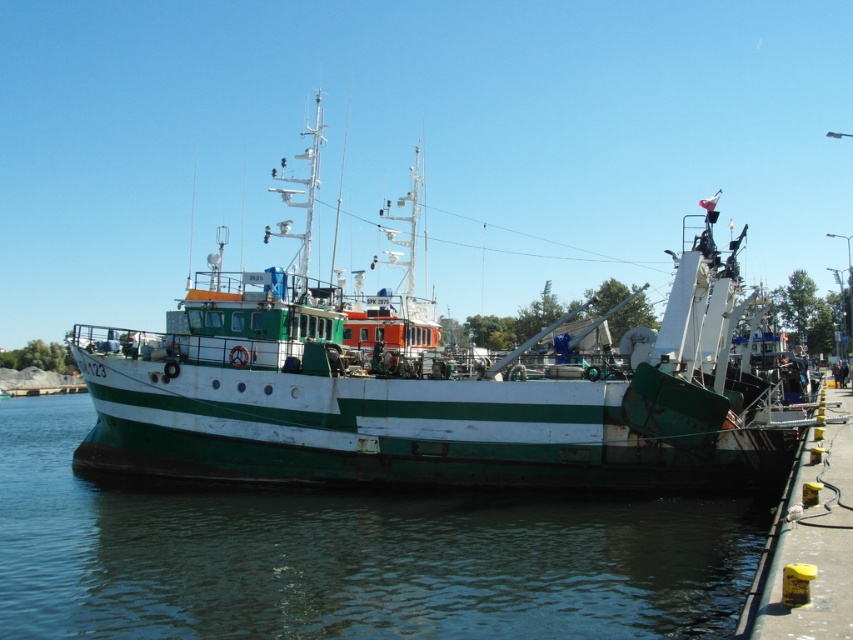
Based on the photo, you are standing at the edge of the pier and want to locate the green matte water at lower center. According to the coordinates provided, what are the exact coordinates where you can find it?

The green matte water at lower center can be found at point (349, 556).

You are an observer standing on the pier and looking at the green matte water at lower center and the green matte boat at center. Which object appears taller from your viewpoint?

The green matte boat at center appears taller than the green matte water at lower center since the water has a lesser height compared to the boat.

You are standing on the pier and see the green matte water at lower center and the green matte boat at center. Which object is located to the right of the other?

The green matte boat at center is located to the right of the green matte water at lower center because the water is positioned on the left side of the boat.